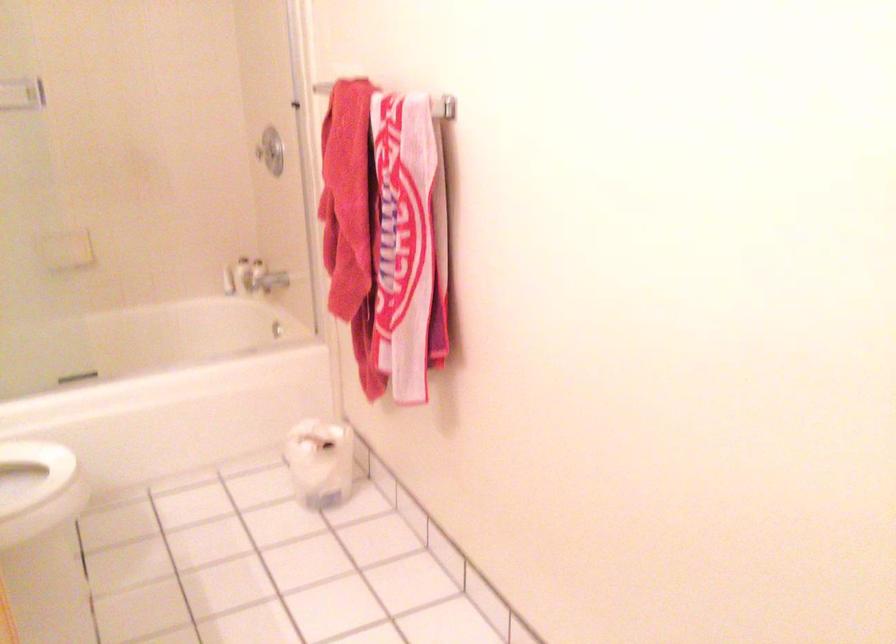
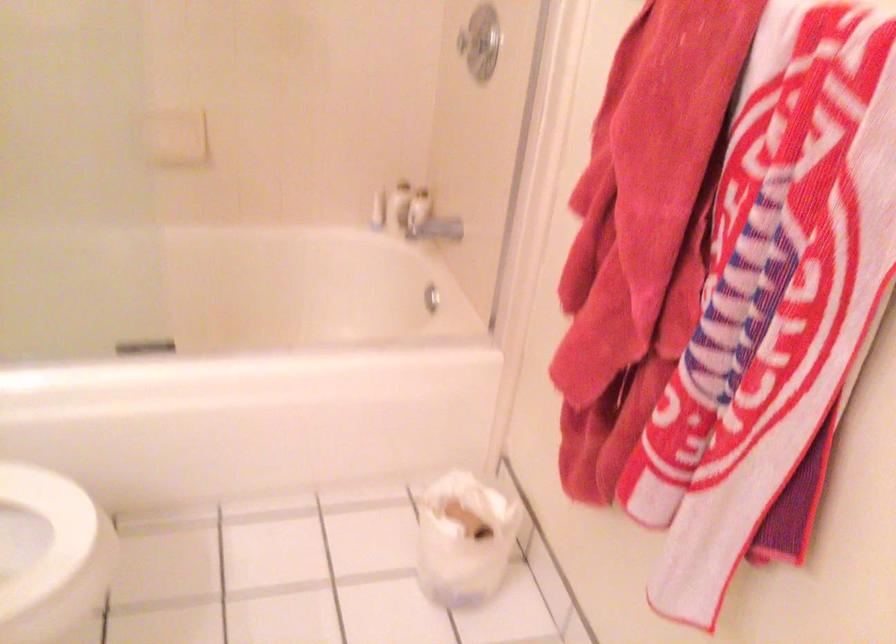
The point at [228,281] is marked in the first image. Where is the corresponding point in the second image?

(378, 211)